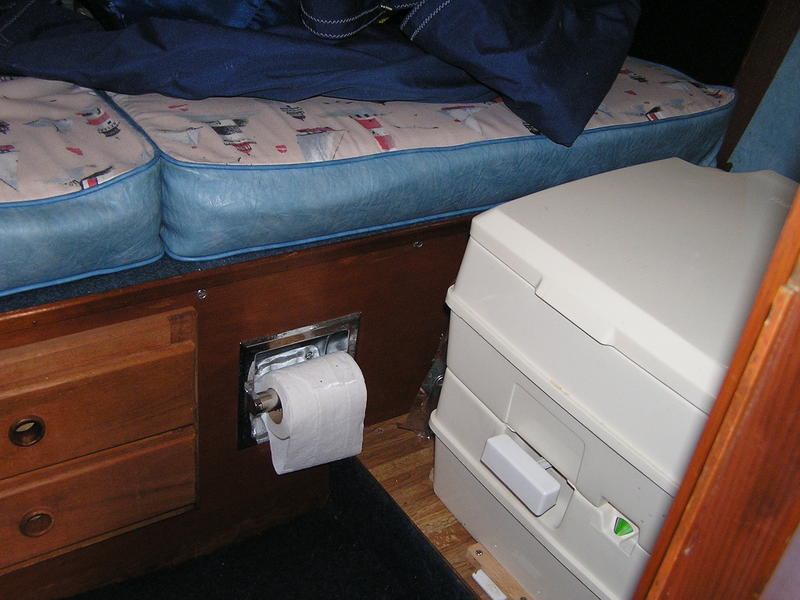
What are the coordinates of `wall` in the screenshot? It's located at (778, 112).